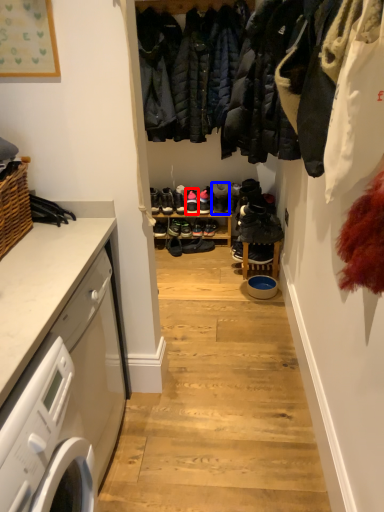
Question: Which object appears closest to the camera in this image, footwear (highlighted by a red box) or shoe (highlighted by a blue box)?

Choices:
 (A) footwear
 (B) shoe

Answer: (B)